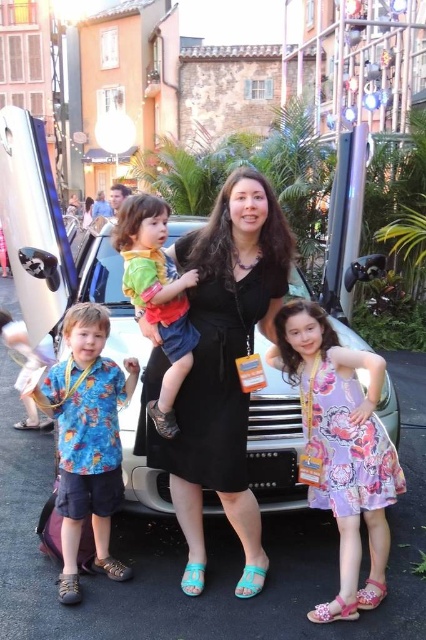
Is floral dress at center positioned at the back of matte green shirt at center?

No.

Who is positioned more to the right, floral dress at center or matte green shirt at center?

floral dress at center is more to the right.

The image size is (426, 640). Find the location of `floral dress at center`. floral dress at center is located at coordinates (342, 448).

Is black matte dress at center thinner than blue printed shirt at center?

Incorrect, black matte dress at center's width is not less than blue printed shirt at center's.

Can you confirm if black matte dress at center is positioned below blue printed shirt at center?

No.

Which is in front, point (273, 220) or point (92, 492)?

Point (273, 220)

In order to click on black matte dress at center in this screenshot , I will do `click(219, 369)`.

Which of these two, black matte dress at center or floral dress at center, stands shorter?

floral dress at center is shorter.

Can you confirm if black matte dress at center is bigger than floral dress at center?

Yes.

Locate an element on the screen. The width and height of the screenshot is (426, 640). black matte dress at center is located at coordinates (219, 369).

Find the location of a particular element. This screenshot has height=640, width=426. black matte dress at center is located at coordinates (219, 369).